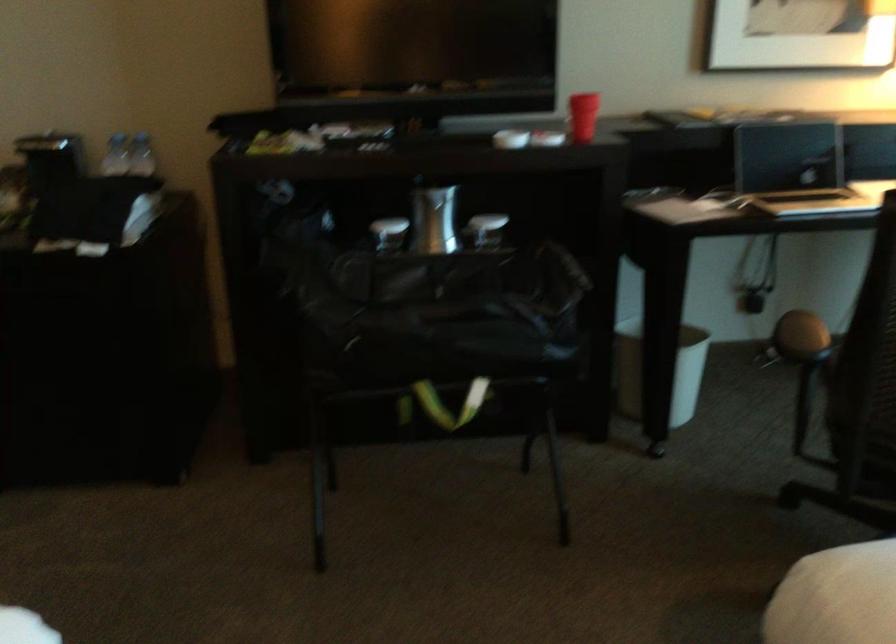
The height and width of the screenshot is (644, 896). Find the location of `red plastic cup`. red plastic cup is located at coordinates (582, 116).